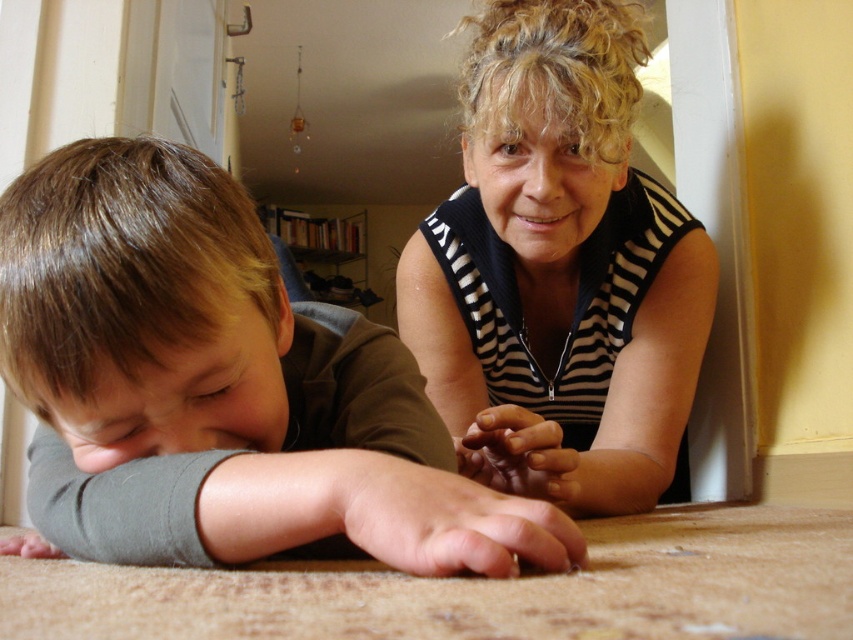
Question: Is brown matte shirt at lower left thinner than black striped shirt at upper center?

Choices:
 (A) no
 (B) yes

Answer: (B)

Question: Does brown matte shirt at lower left have a greater width compared to black striped shirt at upper center?

Choices:
 (A) yes
 (B) no

Answer: (B)

Question: Which object appears closest to the camera in this image?

Choices:
 (A) black striped shirt at upper center
 (B) brown matte shirt at lower left

Answer: (B)

Question: Which object appears closest to the camera in this image?

Choices:
 (A) brown matte shirt at lower left
 (B) black striped shirt at upper center

Answer: (A)

Question: Does brown matte shirt at lower left appear under black striped shirt at upper center?

Choices:
 (A) no
 (B) yes

Answer: (B)

Question: Which point appears closest to the camera in this image?

Choices:
 (A) (572, 369)
 (B) (136, 316)

Answer: (B)